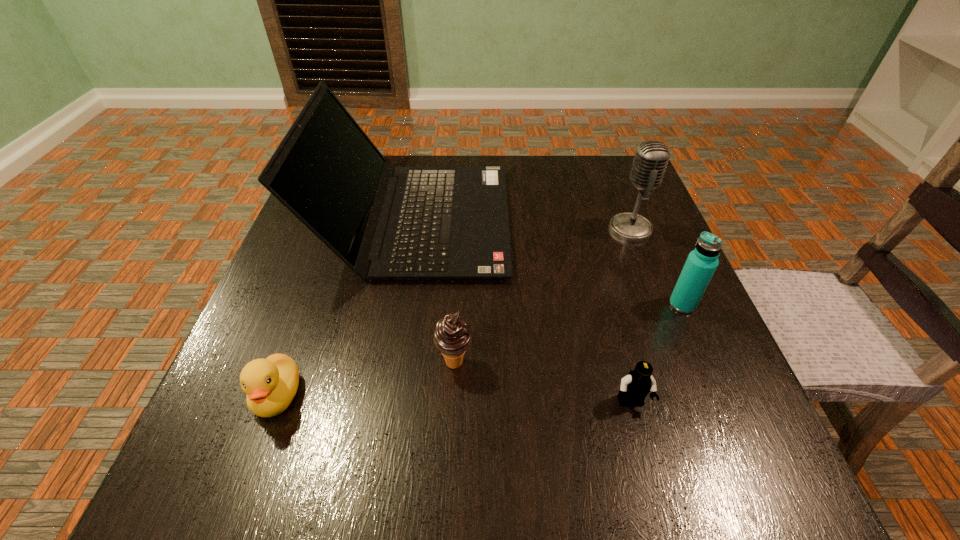
In the image, there is a desktop. Find the location of `vacant space at the far edge`. vacant space at the far edge is located at coordinates (412, 158).

This screenshot has width=960, height=540. Identify the location of free spot at the left edge of the desktop. (340, 260).

Where is `free space at the right edge of the desktop`? The image size is (960, 540). free space at the right edge of the desktop is located at coordinates (641, 312).

At what (x,y) coordinates should I click in order to perform the action: click on vacant space at the near left corner of the desktop. Please return your answer as a coordinate pair (x, y). Looking at the image, I should click on (195, 498).

This screenshot has width=960, height=540. In order to click on free point at the far right corner in this screenshot , I will do `click(637, 192)`.

In the image, there is a desktop. Where is `free space at the near right corner`? free space at the near right corner is located at coordinates (699, 495).

This screenshot has width=960, height=540. Identify the location of free space between the second tallest object and the fourth tallest object. (542, 295).

What are the coordinates of `free area in between the fourth tallest object and the Lego` in the screenshot? It's located at (542, 383).

Image resolution: width=960 pixels, height=540 pixels. Find the location of `vacant space that is in between the duckling and the third object from right to left`. vacant space that is in between the duckling and the third object from right to left is located at coordinates (454, 399).

Where is `unoccupied area between the icecream and the laptop computer`? This screenshot has height=540, width=960. unoccupied area between the icecream and the laptop computer is located at coordinates (435, 292).